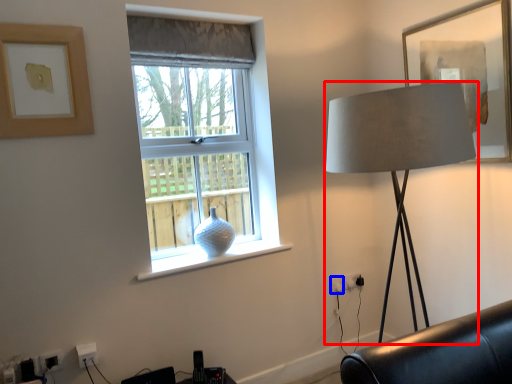
Question: Which of the following is the farthest to the observer, lamp (highlighted by a red box) or electric outlet (highlighted by a blue box)?

Choices:
 (A) lamp
 (B) electric outlet

Answer: (B)